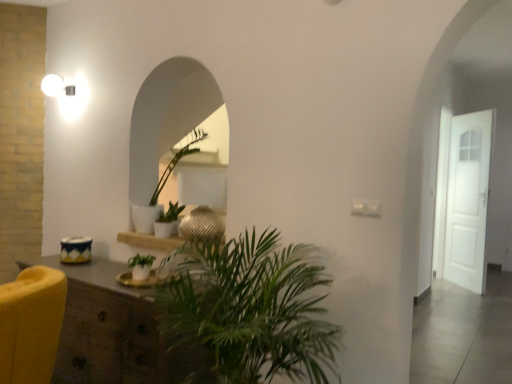
What do you see at coordinates (249, 311) in the screenshot? I see `green leafy plant at center, acting as the 1th houseplant starting from the front` at bounding box center [249, 311].

At what (x,y) coordinates should I click in order to perform the action: click on white matte door at right. Please return your answer as a coordinate pair (x, y). Looking at the image, I should click on (464, 201).

What do you see at coordinates (150, 241) in the screenshot?
I see `wooden shelf at center` at bounding box center [150, 241].

Locate an element on the screen. The height and width of the screenshot is (384, 512). green leafy plant at center, acting as the 1th houseplant starting from the front is located at coordinates [x=249, y=311].

Is white matte door at right facing towards green matte plant at center, the first houseplant in the back-to-front sequence?

No, white matte door at right is not oriented towards green matte plant at center, the first houseplant in the back-to-front sequence.

Looking at the image, does white matte door at right seem bigger or smaller compared to green matte plant at center, which is counted as the 1th houseplant, starting from the top?

Considering their sizes, white matte door at right takes up more space than green matte plant at center, which is counted as the 1th houseplant, starting from the top.

Which of these two, white matte door at right or green matte plant at center, which is the 3th houseplant in bottom-to-top order, is thinner?

white matte door at right is thinner.

In the scene shown: In terms of height, does white matte door at right look taller or shorter compared to green matte plant at center, the 3th houseplant from the front?

Clearly, white matte door at right is taller compared to green matte plant at center, the 3th houseplant from the front.

Measure the distance from wooden cabinet at lower left to green matte plant at center, the 3th houseplant from the front.

27.78 inches.

Is wooden cabinet at lower left smaller than green matte plant at center, the first houseplant in the back-to-front sequence?

No, wooden cabinet at lower left is not smaller than green matte plant at center, the first houseplant in the back-to-front sequence.

Does wooden cabinet at lower left lie behind green matte plant at center, which is the 3th houseplant in bottom-to-top order?

No, the depth of wooden cabinet at lower left is less than that of green matte plant at center, which is the 3th houseplant in bottom-to-top order.

Considering the positions of objects wooden cabinet at lower left and green matte plant at center, which is counted as the 1th houseplant, starting from the top, in the image provided, who is more to the right, wooden cabinet at lower left or green matte plant at center, which is counted as the 1th houseplant, starting from the top,?

green matte plant at center, which is counted as the 1th houseplant, starting from the top.

Consider the image. Which object is thinner, wooden shelf at center or green leafy plant at center, the 3th houseplant in the top-to-bottom sequence?

wooden shelf at center.

Is wooden shelf at center taller or shorter than green leafy plant at center, the 3th houseplant when ordered from back to front?

Clearly, wooden shelf at center is shorter compared to green leafy plant at center, the 3th houseplant when ordered from back to front.

This screenshot has width=512, height=384. In the image, there is a green leafy plant at center, the 3th houseplant when ordered from back to front. Find the location of `shelf above it (from the image's perspective)`. shelf above it (from the image's perspective) is located at coordinates (150, 241).

From the image's perspective, who appears lower, wooden shelf at center or green leafy plant at center, which ranks as the first houseplant in bottom-to-top order?

green leafy plant at center, which ranks as the first houseplant in bottom-to-top order, is shown below in the image.

This screenshot has height=384, width=512. I want to click on houseplant that is the 2nd object located below the wooden shelf at center (from the image's perspective), so click(249, 311).

Would you say wooden shelf at center is part of green leafy plant at center, the 3th houseplant in the top-to-bottom sequence,'s contents?

Definitely not — wooden shelf at center is not inside green leafy plant at center, the 3th houseplant in the top-to-bottom sequence.

Considering the sizes of objects green leafy plant at center, the 3th houseplant in the top-to-bottom sequence, and wooden shelf at center in the image provided, who is wider, green leafy plant at center, the 3th houseplant in the top-to-bottom sequence, or wooden shelf at center?

green leafy plant at center, the 3th houseplant in the top-to-bottom sequence, is wider.

Can you confirm if green leafy plant at center, acting as the 1th houseplant starting from the front, is taller than wooden shelf at center?

Yes.

Does point (225, 380) lie in front of point (147, 225)?

Yes, point (225, 380) is in front of point (147, 225).

Can you confirm if green leafy plant at center, the 3th houseplant in the top-to-bottom sequence, is positioned to the left of green matte plant at center, which is the 3th houseplant in bottom-to-top order?

No.

Looking at this image, is green leafy plant at center, which ranks as the first houseplant in bottom-to-top order, in front of or behind green matte plant at center, the 3th houseplant from the front, in the image?

Visually, green leafy plant at center, which ranks as the first houseplant in bottom-to-top order, is located in front of green matte plant at center, the 3th houseplant from the front.

Is point (291, 374) closer to camera compared to point (144, 264)?

Yes, point (291, 374) is closer to viewer.

Is green leafy plant at center, which ranks as the first houseplant in bottom-to-top order, further to the viewer compared to green matte plant at center, which ranks as the second houseplant in top-to-bottom order?

No, it is not.

From a real-world perspective, is green leafy plant at center, the 3th houseplant when ordered from back to front, physically above green matte plant at center, the second houseplant ordered from the bottom?

No, from a real-world perspective, green leafy plant at center, the 3th houseplant when ordered from back to front, is not on top of green matte plant at center, the second houseplant ordered from the bottom.

From the image's perspective, is green leafy plant at center, the 3th houseplant in the top-to-bottom sequence, over green matte plant at center, which is the 2th houseplant in back-to-front order?

No, from the image's perspective, green leafy plant at center, the 3th houseplant in the top-to-bottom sequence, is not on top of green matte plant at center, which is the 2th houseplant in back-to-front order.

The width and height of the screenshot is (512, 384). I want to click on door lying above the wooden cabinet at lower left (from the image's perspective), so click(464, 201).

Is white matte door at right next to wooden cabinet at lower left?

No, white matte door at right is not making contact with wooden cabinet at lower left.

Between white matte door at right and wooden cabinet at lower left, which one is positioned behind?

white matte door at right is behind.

Identify the location of the 1st houseplant in front of the white matte door at right. (160, 192).

Locate an element on the screen. cabinetry that is below the green matte plant at center, which is counted as the 1th houseplant, starting from the top (from the image's perspective) is located at coordinates tap(111, 330).

Considering their positions, is green matte plant at center, the first houseplant in the back-to-front sequence, positioned further to green matte plant at center, the second houseplant ordered from the bottom, than white matte door at right?

Among the two, white matte door at right is located further to green matte plant at center, the second houseplant ordered from the bottom.

When comparing their distances from green leafy plant at center, acting as the 1th houseplant starting from the front, does green matte plant at center, which is counted as the 1th houseplant, starting from the top, or wooden shelf at center seem further?

green matte plant at center, which is counted as the 1th houseplant, starting from the top, is further to green leafy plant at center, acting as the 1th houseplant starting from the front.

In the scene shown: Based on their spatial positions, is green matte plant at center, which is the 2th houseplant in back-to-front order, or wooden cabinet at lower left further from green leafy plant at center, acting as the 1th houseplant starting from the front?

green matte plant at center, which is the 2th houseplant in back-to-front order.

Estimate the real-world distances between objects in this image. Which object is further from green matte plant at center, which is the 2th houseplant in back-to-front order, wooden cabinet at lower left or green leafy plant at center, which ranks as the first houseplant in bottom-to-top order?

The object further to green matte plant at center, which is the 2th houseplant in back-to-front order, is green leafy plant at center, which ranks as the first houseplant in bottom-to-top order.

Which object lies nearer to the anchor point wooden shelf at center, green leafy plant at center, acting as the 1th houseplant starting from the front, or green matte plant at center, which is the 3th houseplant in bottom-to-top order?

green matte plant at center, which is the 3th houseplant in bottom-to-top order, is positioned closer to the anchor wooden shelf at center.

Looking at the image, which one is located further to green matte plant at center, the first houseplant in the back-to-front sequence, white matte door at right or wooden cabinet at lower left?

white matte door at right is positioned further to the anchor green matte plant at center, the first houseplant in the back-to-front sequence.

When comparing their distances from green matte plant at center, which ranks as the 2th houseplant in front-to-back order, does green matte plant at center, the 3th houseplant from the front, or wooden shelf at center seem closer?

wooden shelf at center is closer to green matte plant at center, which ranks as the 2th houseplant in front-to-back order.

Estimate the real-world distances between objects in this image. Which object is closer to green matte plant at center, the second houseplant ordered from the bottom, wooden cabinet at lower left or wooden shelf at center?

wooden shelf at center.

What are the coordinates of `shelf between green leafy plant at center, the 3th houseplant when ordered from back to front, and white matte door at right from front to back` in the screenshot? It's located at (150, 241).

At what (x,y) coordinates should I click in order to perform the action: click on shelf located between green leafy plant at center, the 3th houseplant when ordered from back to front, and green matte plant at center, the 3th houseplant from the front, in the depth direction. Please return your answer as a coordinate pair (x, y). Looking at the image, I should click on (150, 241).

The image size is (512, 384). In order to click on shelf between green matte plant at center, which is the 2th houseplant in back-to-front order, and white matte door at right, in the horizontal direction in this screenshot , I will do `click(150, 241)`.

The image size is (512, 384). In order to click on shelf between green matte plant at center, the 3th houseplant from the front, and white matte door at right, in the horizontal direction in this screenshot , I will do `click(150, 241)`.